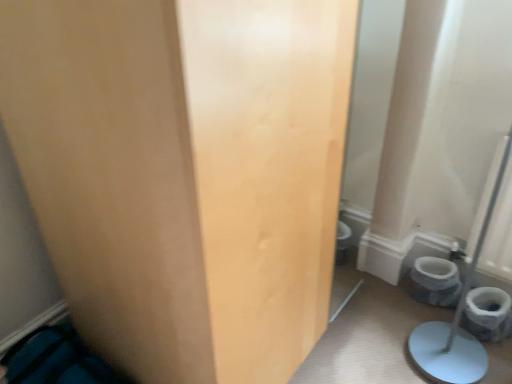
Question: In the image, is gray matte toilet bowl at lower right positioned in front of or behind matte wood door at center?

Choices:
 (A) front
 (B) behind

Answer: (B)

Question: Looking at the image, does gray matte toilet bowl at lower right seem bigger or smaller compared to matte wood door at center?

Choices:
 (A) small
 (B) big

Answer: (A)

Question: In terms of width, does gray matte toilet bowl at lower right look wider or thinner when compared to matte wood door at center?

Choices:
 (A) wide
 (B) thin

Answer: (B)

Question: From a real-world perspective, relative to gray matte toilet bowl at lower right, is matte wood door at center vertically above or below?

Choices:
 (A) below
 (B) above

Answer: (B)

Question: In terms of height, does matte wood door at center look taller or shorter compared to gray matte toilet bowl at lower right?

Choices:
 (A) tall
 (B) short

Answer: (A)

Question: Is matte wood door at center in front of or behind gray matte toilet bowl at lower right in the image?

Choices:
 (A) behind
 (B) front

Answer: (B)

Question: Do you think matte wood door at center is within gray matte toilet bowl at lower right, or outside of it?

Choices:
 (A) outside
 (B) inside

Answer: (A)